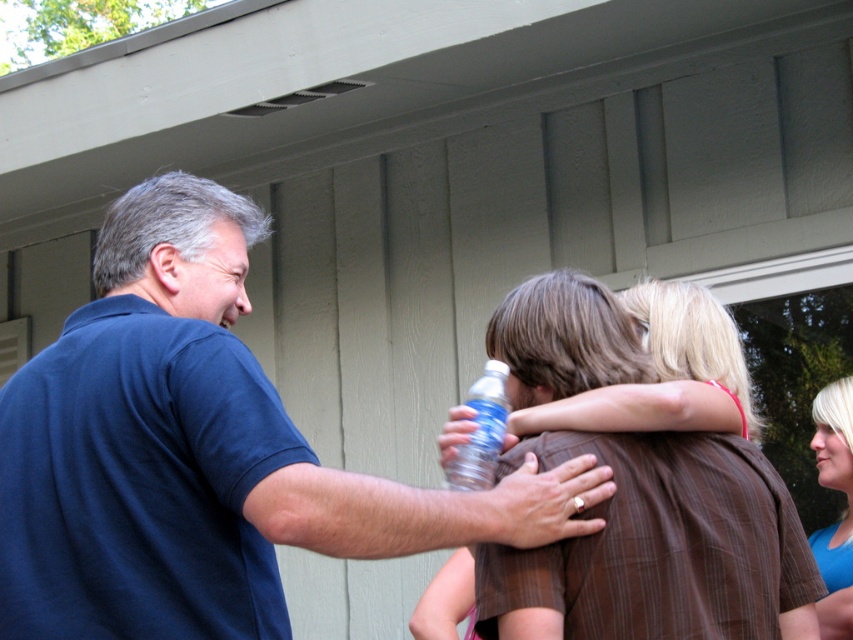
Who is taller, blue cotton shirt at center or blonde hair at center?

Standing taller between the two is blue cotton shirt at center.

Which is below, blue cotton shirt at center or blonde hair at center?

blue cotton shirt at center

Between point (273, 408) and point (691, 426), which one is positioned in front?

Positioned in front is point (273, 408).

You are a GUI agent. You are given a task and a screenshot of the screen. Output one action in this format:
    pyautogui.click(x=<x>, y=<y>)
    Task: Click on the blue cotton shirt at center
    Image resolution: width=853 pixels, height=640 pixels.
    Given the screenshot: What is the action you would take?
    pyautogui.click(x=200, y=452)

I want to click on blonde hair at upper right, so click(845, 509).

From the picture: Can you confirm if blonde hair at upper right is positioned below clear plastic bottle at center?

Indeed, blonde hair at upper right is positioned under clear plastic bottle at center.

Measure the distance between point (844,419) and camera.

Point (844,419) is 5.17 meters from camera.

In order to click on blonde hair at upper right in this screenshot , I will do `click(845, 509)`.

Who is lower down, blonde hair at center or blonde hair at upper right?

blonde hair at upper right is below.

Does blonde hair at center have a lesser width compared to blonde hair at upper right?

No, blonde hair at center is not thinner than blonde hair at upper right.

The image size is (853, 640). Describe the element at coordinates (662, 372) in the screenshot. I see `blonde hair at center` at that location.

The width and height of the screenshot is (853, 640). In order to click on blonde hair at center in this screenshot , I will do `click(662, 372)`.